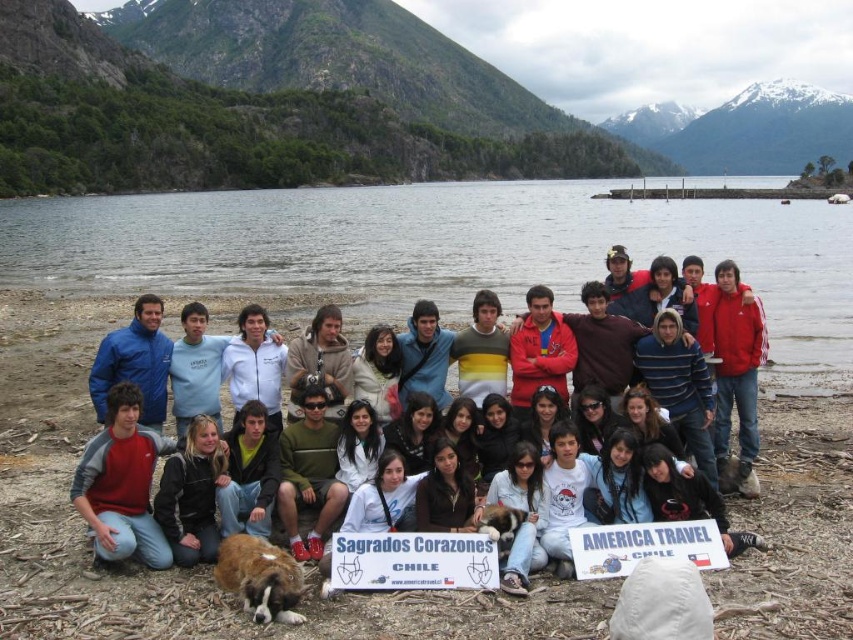
Question: Can you confirm if matte blue jacket at center is bigger than brown fur dog at center?

Choices:
 (A) yes
 (B) no

Answer: (A)

Question: Is white plastic sign at center thinner than black leather jacket at lower left?

Choices:
 (A) yes
 (B) no

Answer: (B)

Question: Which object appears farthest from the camera in this image?

Choices:
 (A) fluffy brown dog at lower center
 (B) matte blue jacket at center

Answer: (B)

Question: Is white plastic sign at center above black leather jacket at lower left?

Choices:
 (A) yes
 (B) no

Answer: (B)

Question: Which point appears closest to the camera in this image?

Choices:
 (A) (585, 385)
 (B) (514, 538)
 (C) (486, 547)

Answer: (C)

Question: Estimate the real-world distances between objects in this image. Which object is farther from the black leather jacket at lower left?

Choices:
 (A) brown fur dog at center
 (B) fluffy brown dog at lower center
 (C) white plastic sign at center

Answer: (A)